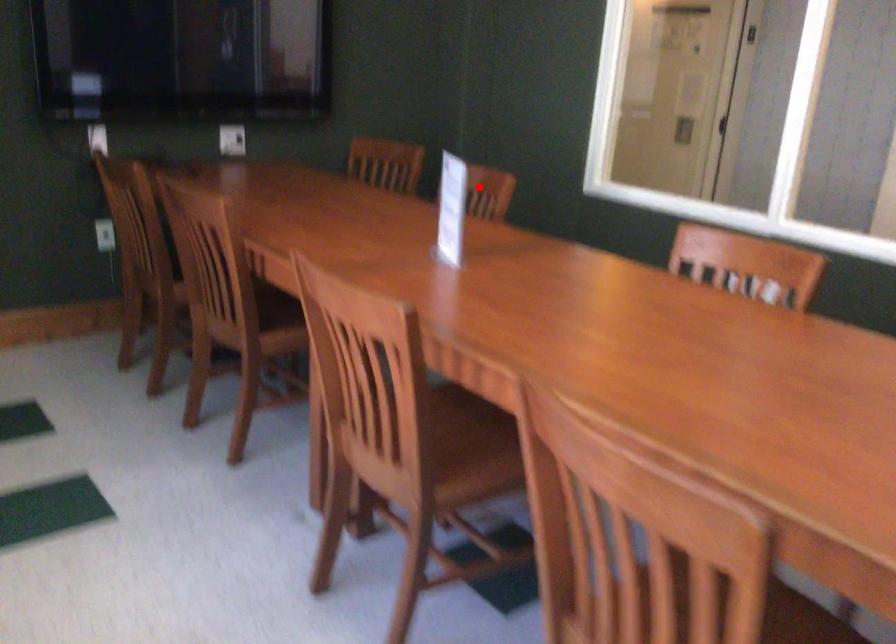
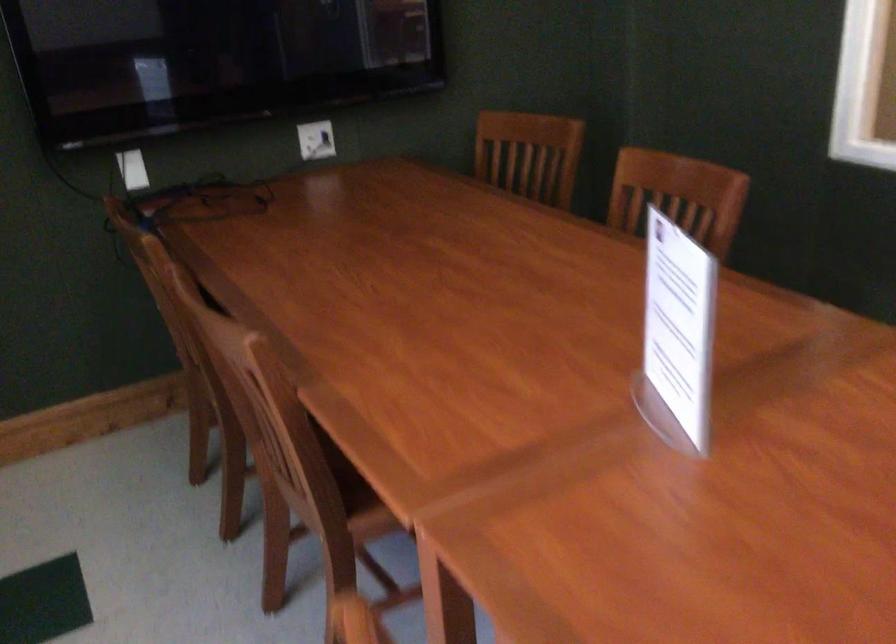
In the second image, find the point that corresponds to the highlighted location in the first image.

(677, 196)